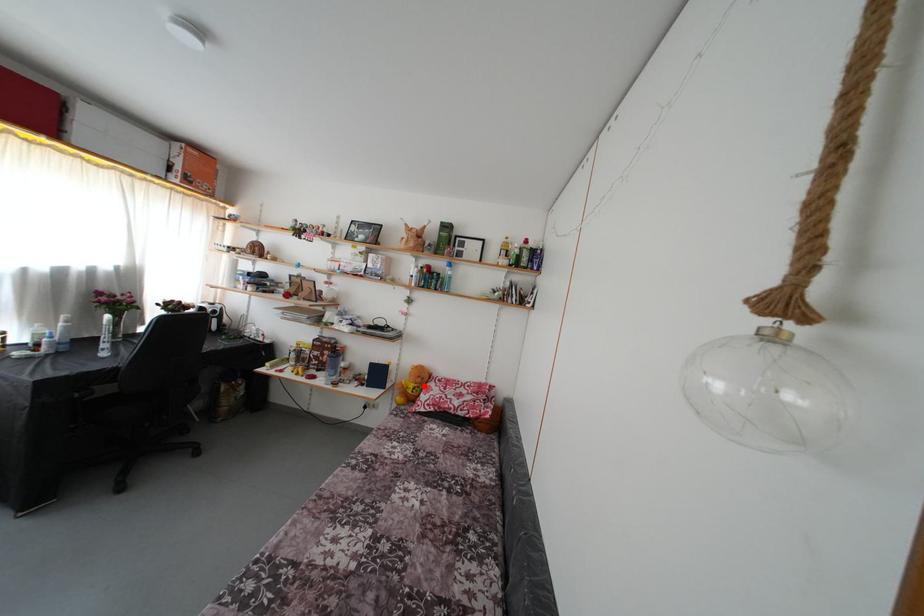
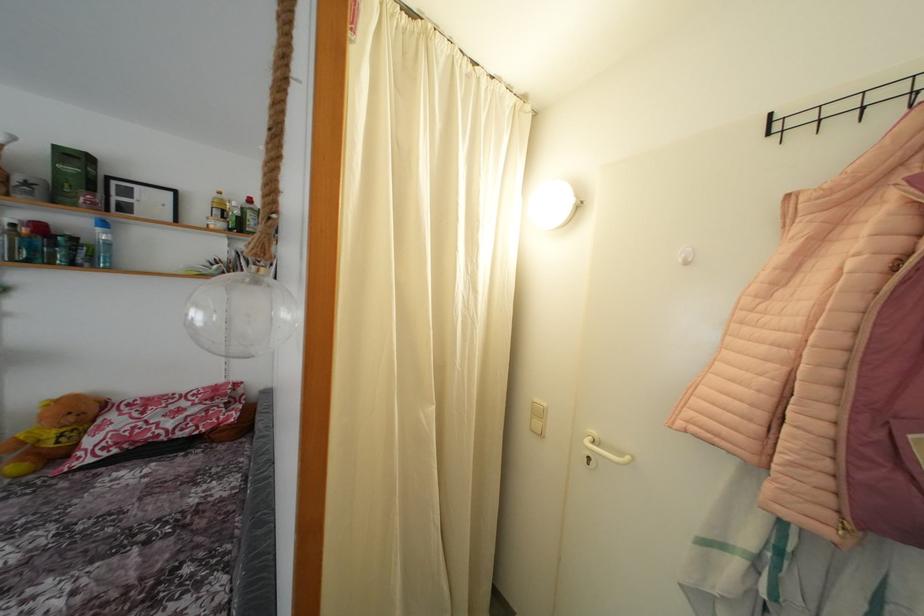
The point at the highlighted location is marked in the first image. Where is the corresponding point in the second image?

(77, 424)